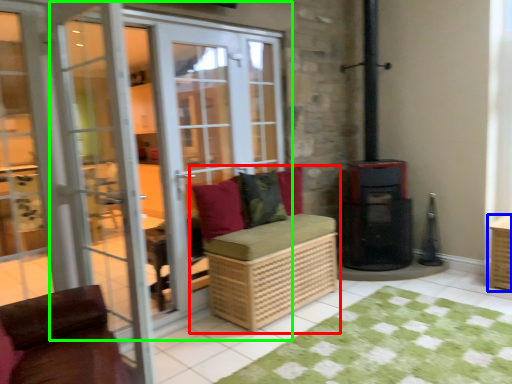
Question: Estimate the real-world distances between objects in this image. Which object is closer to furniture (highlighted by a red box), crate (highlighted by a blue box) or door (highlighted by a green box)?

Choices:
 (A) crate
 (B) door

Answer: (B)